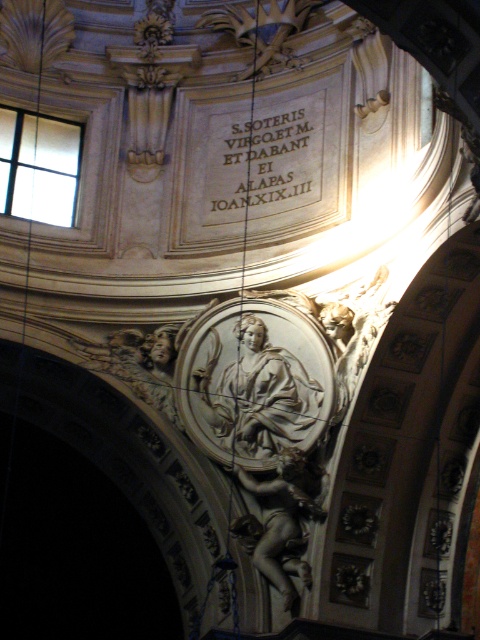
Question: Does silver metallic statue at center appear on the right side of gray stone cherub at center?

Choices:
 (A) yes
 (B) no

Answer: (B)

Question: Is silver metallic statue at center thinner than white stone inscription at upper center?

Choices:
 (A) yes
 (B) no

Answer: (B)

Question: Which point appears farthest from the camera in this image?

Choices:
 (A) (243, 132)
 (B) (286, 502)

Answer: (A)

Question: Which point is closer to the camera taking this photo?

Choices:
 (A) (236, 396)
 (B) (286, 116)

Answer: (A)

Question: Is the position of white stone inscription at upper center less distant than that of gray stone cherub at center?

Choices:
 (A) no
 (B) yes

Answer: (A)

Question: Considering the real-world distances, which object is farthest from the white stone inscription at upper center?

Choices:
 (A) gray stone cherub at center
 (B) silver metallic statue at center

Answer: (A)